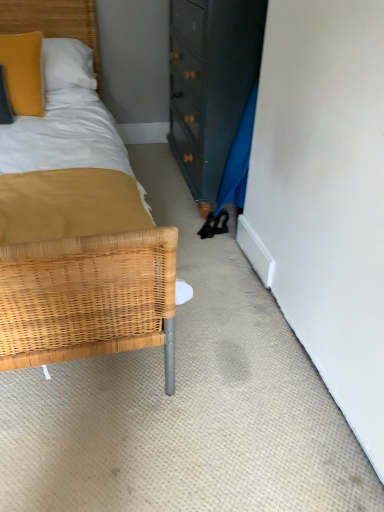
What is the approximate width of matte yellow pillow at upper left?

matte yellow pillow at upper left is 11.86 inches in width.

What do you see at coordinates (23, 71) in the screenshot?
I see `matte yellow pillow at upper left` at bounding box center [23, 71].

In order to face matte yellow pillow at upper left, should I rotate leftwards or rightwards?

Turn left by 22.865 degrees to look at matte yellow pillow at upper left.

You are a GUI agent. You are given a task and a screenshot of the screen. Output one action in this format:
    pyautogui.click(x=<x>, y=<y>)
    Task: Click on the matte yellow pillow at upper left
    The width and height of the screenshot is (384, 512).
    Given the screenshot: What is the action you would take?
    pyautogui.click(x=23, y=71)

Identify the location of woven wood headboard at upper left. (55, 22).

Describe the element at coordinates (55, 22) in the screenshot. This screenshot has height=512, width=384. I see `woven wood headboard at upper left` at that location.

The height and width of the screenshot is (512, 384). Find the location of `matte yellow pillow at upper left`. matte yellow pillow at upper left is located at coordinates (23, 71).

Does woven wood headboard at upper left appear on the right side of matte yellow pillow at upper left?

Correct, you'll find woven wood headboard at upper left to the right of matte yellow pillow at upper left.

Which object is more forward, woven wood headboard at upper left or matte yellow pillow at upper left?

Positioned in front is matte yellow pillow at upper left.

Considering the positions of point (76, 3) and point (19, 63), is point (76, 3) closer or farther from the camera than point (19, 63)?

Point (76, 3) appears to be farther away from the viewer than point (19, 63).

From the image's perspective, is woven wood headboard at upper left located beneath matte yellow pillow at upper left?

No.

From a real-world perspective, who is located lower, woven wood headboard at upper left or matte yellow pillow at upper left?

woven wood headboard at upper left.

Considering the sizes of objects woven wood headboard at upper left and matte yellow pillow at upper left in the image provided, who is wider, woven wood headboard at upper left or matte yellow pillow at upper left?

Wider between the two is woven wood headboard at upper left.

Considering the sizes of objects woven wood headboard at upper left and matte yellow pillow at upper left in the image provided, who is shorter, woven wood headboard at upper left or matte yellow pillow at upper left?

With less height is matte yellow pillow at upper left.

Does woven wood headboard at upper left have a larger size compared to matte yellow pillow at upper left?

Correct, woven wood headboard at upper left is larger in size than matte yellow pillow at upper left.

Is woven wood headboard at upper left situated inside matte yellow pillow at upper left or outside?

woven wood headboard at upper left cannot be found inside matte yellow pillow at upper left.

Is woven wood headboard at upper left directly adjacent to matte yellow pillow at upper left?

They are not placed beside each other.

Does woven wood headboard at upper left turn towards matte yellow pillow at upper left?

Yes.

How different are the orientations of woven wood headboard at upper left and matte yellow pillow at upper left in degrees?

woven wood headboard at upper left and matte yellow pillow at upper left are facing 19.4 degrees away from each other.

At what (x,y) coordinates should I click in order to perform the action: click on pillow positioned vertically above the woven wood headboard at upper left (from a real-world perspective). Please return your answer as a coordinate pair (x, y). This screenshot has height=512, width=384. Looking at the image, I should click on (23, 71).

Can you confirm if matte yellow pillow at upper left is positioned to the right of woven wood headboard at upper left?

No, matte yellow pillow at upper left is not to the right of woven wood headboard at upper left.

Considering the positions of objects matte yellow pillow at upper left and woven wood headboard at upper left in the image provided, who is behind, matte yellow pillow at upper left or woven wood headboard at upper left?

woven wood headboard at upper left is further away from the camera.

Is point (26, 38) more distant than point (2, 16)?

That is False.

From the image's perspective, which one is positioned higher, matte yellow pillow at upper left or woven wood headboard at upper left?

woven wood headboard at upper left appears higher in the image.

Consider the image. From a real-world perspective, which object rests below the other?

woven wood headboard at upper left is physically lower.

Which of these two, matte yellow pillow at upper left or woven wood headboard at upper left, is wider?

woven wood headboard at upper left.

Can you confirm if matte yellow pillow at upper left is taller than woven wood headboard at upper left?

No, matte yellow pillow at upper left is not taller than woven wood headboard at upper left.

Considering the sizes of matte yellow pillow at upper left and woven wood headboard at upper left in the image, is matte yellow pillow at upper left bigger or smaller than woven wood headboard at upper left?

Clearly, matte yellow pillow at upper left is smaller in size than woven wood headboard at upper left.

Is woven wood headboard at upper left a part of matte yellow pillow at upper left?

No.

Does matte yellow pillow at upper left touch woven wood headboard at upper left?

No, matte yellow pillow at upper left is not next to woven wood headboard at upper left.

Is woven wood headboard at upper left at the back of matte yellow pillow at upper left?

Absolutely, matte yellow pillow at upper left is directed away from woven wood headboard at upper left.

You are a GUI agent. You are given a task and a screenshot of the screen. Output one action in this format:
    pyautogui.click(x=<x>, y=<y>)
    Task: Click on the pillow in front of the woven wood headboard at upper left
    Image resolution: width=384 pixels, height=512 pixels.
    Given the screenshot: What is the action you would take?
    pyautogui.click(x=23, y=71)

Where is `headboard located behind the matte yellow pillow at upper left`? The width and height of the screenshot is (384, 512). headboard located behind the matte yellow pillow at upper left is located at coordinates (55, 22).

The width and height of the screenshot is (384, 512). In the image, there is a matte yellow pillow at upper left. What are the coordinates of `headboard below it (from a real-world perspective)` in the screenshot? It's located at pos(55,22).